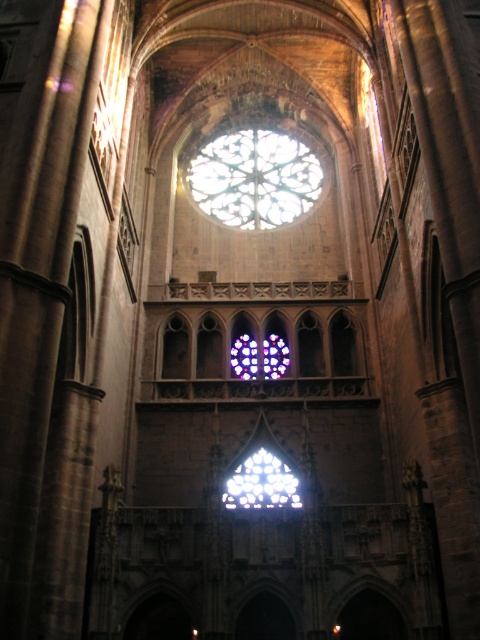
Does stained glass window at center have a lesser height compared to clear glass stained glass at center?

Incorrect, stained glass window at center's height does not fall short of clear glass stained glass at center's.

Who is positioned more to the left, stained glass window at center or clear glass stained glass at center?

Positioned to the left is stained glass window at center.

Is point (241, 131) behind point (248, 506)?

Yes, point (241, 131) is farther from viewer.

I want to click on stained glass window at center, so click(254, 179).